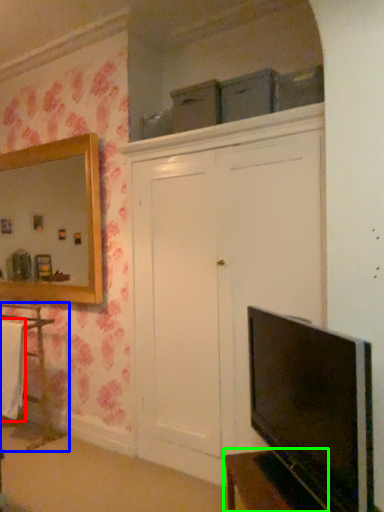
Question: Which is nearer to the laundry (highlighted by a red box)? cabinetry (highlighted by a blue box) or vanity (highlighted by a green box).

Choices:
 (A) cabinetry
 (B) vanity

Answer: (A)